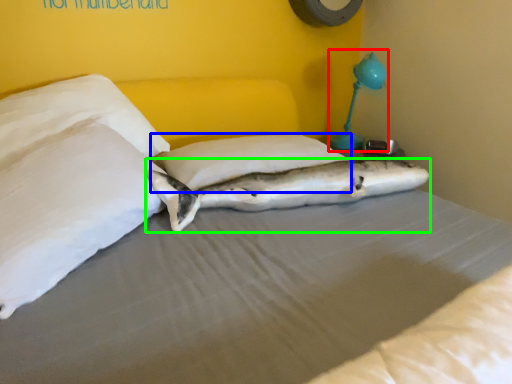
Question: Estimate the real-world distances between objects in this image. Which object is closer to table lamp (highlighted by a red box), pillow (highlighted by a blue box) or shark (highlighted by a green box)?

Choices:
 (A) pillow
 (B) shark

Answer: (A)